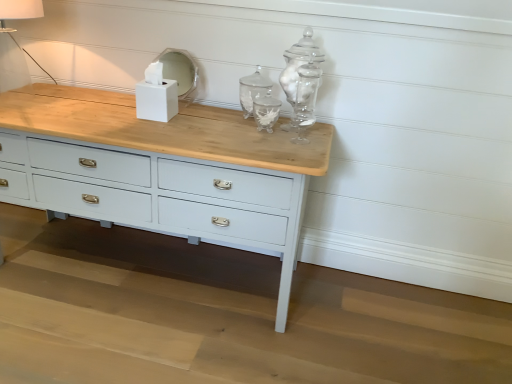
Question: From a real-world perspective, is white fabric lampshade at upper left positioned under white matte tissue box at center based on gravity?

Choices:
 (A) no
 (B) yes

Answer: (A)

Question: Can you confirm if white fabric lampshade at upper left is bigger than white matte tissue box at center?

Choices:
 (A) yes
 (B) no

Answer: (A)

Question: Is white fabric lampshade at upper left at the right side of white matte tissue box at center?

Choices:
 (A) yes
 (B) no

Answer: (B)

Question: Is white fabric lampshade at upper left aimed at white matte tissue box at center?

Choices:
 (A) yes
 (B) no

Answer: (B)

Question: From the image's perspective, would you say white fabric lampshade at upper left is shown under white matte tissue box at center?

Choices:
 (A) yes
 (B) no

Answer: (B)

Question: Relative to white glossy mirror at upper center, is white matte tissue box at center in front or behind?

Choices:
 (A) behind
 (B) front

Answer: (B)

Question: From the image's perspective, is white matte tissue box at center above or below white glossy mirror at upper center?

Choices:
 (A) below
 (B) above

Answer: (A)

Question: From a real-world perspective, is white matte tissue box at center physically located above or below white glossy mirror at upper center?

Choices:
 (A) below
 (B) above

Answer: (A)

Question: Is white matte tissue box at center situated inside white glossy mirror at upper center or outside?

Choices:
 (A) inside
 (B) outside

Answer: (B)

Question: Is white glossy mirror at upper center situated inside white matte tissue box at center or outside?

Choices:
 (A) outside
 (B) inside

Answer: (A)

Question: In the image, is white glossy mirror at upper center positioned in front of or behind white matte tissue box at center?

Choices:
 (A) behind
 (B) front

Answer: (A)

Question: Is white glossy mirror at upper center wider or thinner than white matte tissue box at center?

Choices:
 (A) wide
 (B) thin

Answer: (B)

Question: Considering the positions of white glossy mirror at upper center and white matte tissue box at center in the image, is white glossy mirror at upper center taller or shorter than white matte tissue box at center?

Choices:
 (A) tall
 (B) short

Answer: (A)

Question: Looking at the image, does white fabric lampshade at upper left seem bigger or smaller compared to white matte tissue box at center?

Choices:
 (A) big
 (B) small

Answer: (A)

Question: Visually, is white fabric lampshade at upper left positioned to the left or to the right of white matte tissue box at center?

Choices:
 (A) right
 (B) left

Answer: (B)